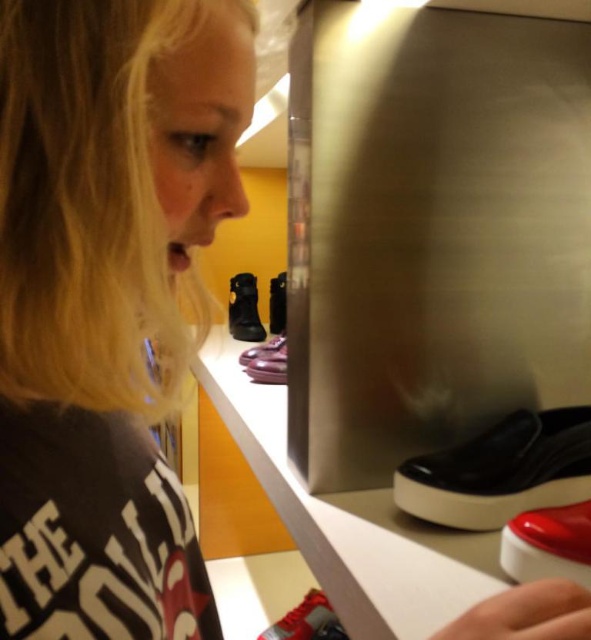
Consider the image. Measure the distance between black matte shoe at lower right and camera.

They are 24.53 inches apart.

Is point (423, 500) farther from camera compared to point (534, 538)?

That is True.

At what (x,y) coordinates should I click in order to perform the action: click on black matte shoe at lower right. Please return your answer as a coordinate pair (x, y). The image size is (591, 640). Looking at the image, I should click on (501, 472).

The image size is (591, 640). What are the coordinates of `black matte shoe at lower right` in the screenshot? It's located at (501, 472).

Does point (173, 83) come farther from viewer compared to point (233, 330)?

That is False.

In the scene shown: How much distance is there between blonde hair at upper left and leather boot at center?

The distance of blonde hair at upper left from leather boot at center is 1.36 meters.

Which is in front, point (154, 172) or point (264, 337)?

Positioned in front is point (154, 172).

Locate an element on the screen. The height and width of the screenshot is (640, 591). blonde hair at upper left is located at coordinates coord(108,300).

Is leather boot at center to the right of matte purple shoe at center from the viewer's perspective?

In fact, leather boot at center is to the left of matte purple shoe at center.

Can you confirm if leather boot at center is positioned above matte purple shoe at center?

Yes, leather boot at center is above matte purple shoe at center.

Where is `leather boot at center`? The height and width of the screenshot is (640, 591). leather boot at center is located at coordinates (245, 308).